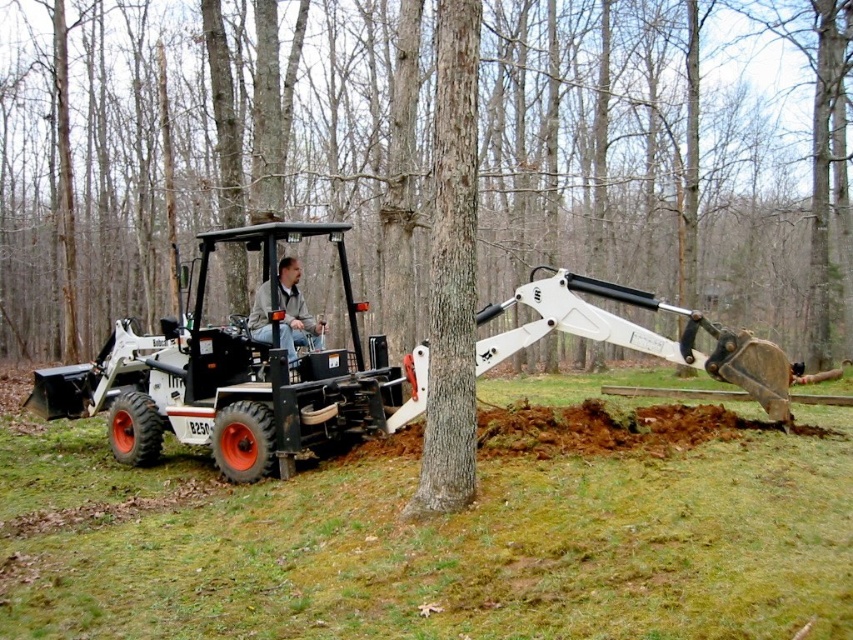
From the picture: You are standing in a wooded area and see a smooth bark tree at center and a leather jacket at center. Which object is taller?

The smooth bark tree at center is taller than the leather jacket at center.

You are a safety inspector checking the distance between the brown rough bark tree trunk at center and the leather jacket at center. According to safety regulations, the minimum safe distance between a tree trunk and any equipment operator must be at least 10 feet. Is the current distance compliant with the safety regulations?

The brown rough bark tree trunk at center and the leather jacket at center are 9.22 feet apart from each other. Since the required minimum safe distance is 10 feet, the current distance of 9.22 feet is below the required threshold, so it does not comply with the safety regulations.

You are standing at the point marked by coordinates point (451, 268) in the wooded area. What is directly beneath your feet?

The point (451, 268) corresponds to the brown rough bark tree trunk at center, so the brown rough bark tree trunk at center is directly beneath your feet.